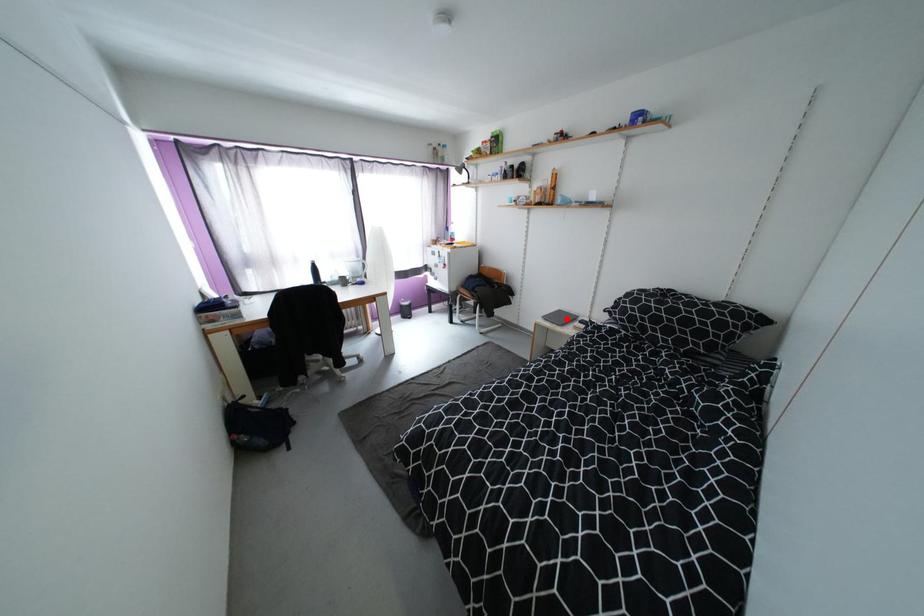
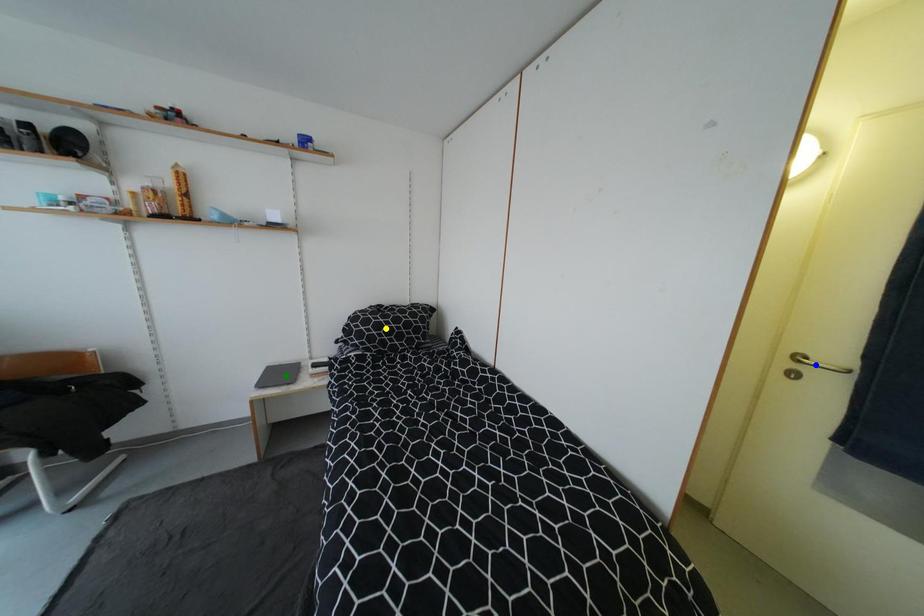
Question: I am providing you with two images of the same scene from different viewpoints. A red point is marked on the first image. You are given multiple points on the second image. Which mark in image 2 goes with the point in image 1?

Choices:
 (A) blue point
 (B) yellow point
 (C) green point

Answer: (C)